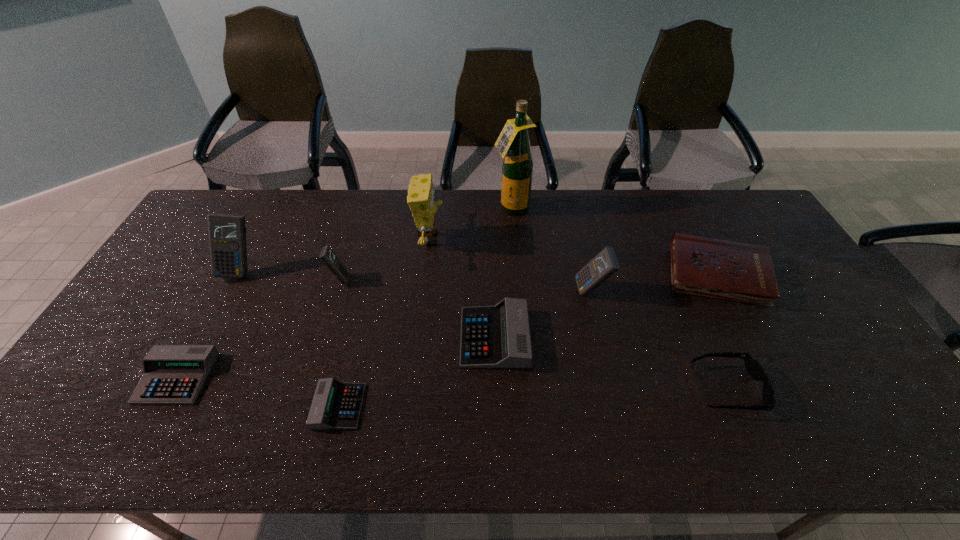
Where is `vacant area situated 0.260m on the front-facing side of the rightmost blue calculator`? This screenshot has height=540, width=960. vacant area situated 0.260m on the front-facing side of the rightmost blue calculator is located at coordinates (489, 291).

The height and width of the screenshot is (540, 960). I want to click on vacant space located on the front-facing side of the rightmost blue calculator, so click(485, 291).

Where is `vacant space located 0.150m on the front-facing side of the rightmost blue calculator`? The height and width of the screenshot is (540, 960). vacant space located 0.150m on the front-facing side of the rightmost blue calculator is located at coordinates [525, 291].

Where is `vacant space positioned on the front-facing side of the smallest blue calculator`? The width and height of the screenshot is (960, 540). vacant space positioned on the front-facing side of the smallest blue calculator is located at coordinates (413, 279).

Image resolution: width=960 pixels, height=540 pixels. Find the location of `vacant space situated on the front of the hardback book`. vacant space situated on the front of the hardback book is located at coordinates coord(766,370).

Find the location of a particular element. Image resolution: width=960 pixels, height=540 pixels. free location located 0.220m on the left of the third shortest calculator is located at coordinates (379, 338).

The height and width of the screenshot is (540, 960). What are the coordinates of `vacant area situated 0.280m on the front-facing side of the black sunglasses` in the screenshot? It's located at (582, 388).

Find the location of `free region located on the front-facing side of the black sunglasses`. free region located on the front-facing side of the black sunglasses is located at coordinates (651, 388).

What are the coordinates of `blank space located 0.260m on the front-facing side of the black sunglasses` in the screenshot? It's located at (589, 388).

At what (x,y) coordinates should I click in order to perform the action: click on vacant position located 0.290m on the back of the second shortest object. Please return your answer as a coordinate pair (x, y). Looking at the image, I should click on (233, 274).